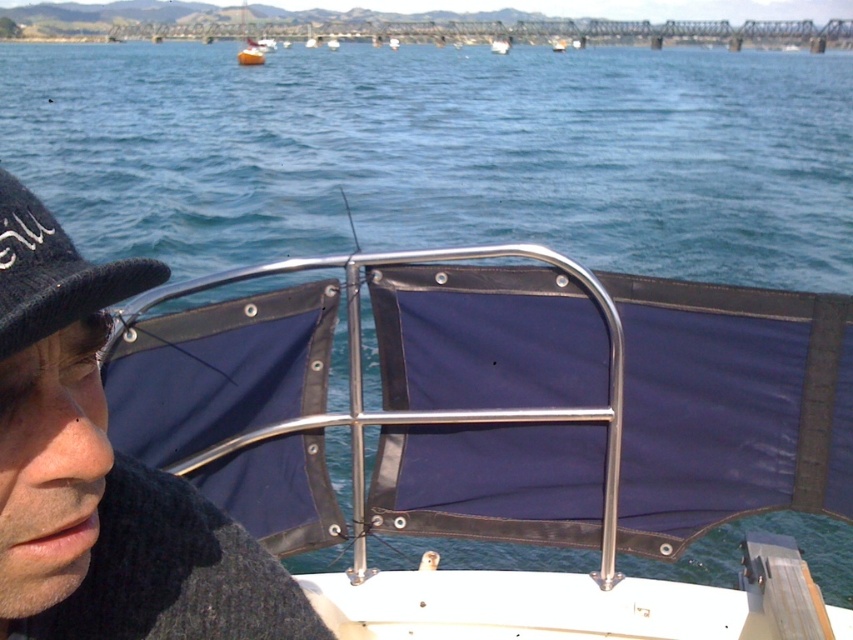
Based on the photo, can you confirm if black fabric baseball hat at left is taller than metallic silver boat at center?

Incorrect, black fabric baseball hat at left's height is not larger of metallic silver boat at center's.

Between black fabric baseball hat at left and metallic silver boat at center, which one appears on the left side from the viewer's perspective?

Positioned to the left is black fabric baseball hat at left.

You are a GUI agent. You are given a task and a screenshot of the screen. Output one action in this format:
    pyautogui.click(x=<x>, y=<y>)
    Task: Click on the black fabric baseball hat at left
    The height and width of the screenshot is (640, 853).
    Given the screenshot: What is the action you would take?
    (x=53, y=273)

Can you confirm if blue water at center is thinner than metallic silver boat at center?

Incorrect, blue water at center's width is not less than metallic silver boat at center's.

Consider the image. Is blue water at center closer to the viewer compared to metallic silver boat at center?

Yes, blue water at center is in front of metallic silver boat at center.

Between point (799, 170) and point (490, 49), which one is positioned behind?

Positioned behind is point (490, 49).

Where is `blue water at center`? blue water at center is located at coordinates (444, 154).

Who is positioned more to the right, black knit cap at left or metallic silver boat at center?

metallic silver boat at center is more to the right.

Does black knit cap at left have a larger size compared to metallic silver boat at center?

Incorrect, black knit cap at left is not larger than metallic silver boat at center.

Between point (28, 579) and point (491, 51), which one is positioned in front?

Point (28, 579)

Locate an element on the screen. The height and width of the screenshot is (640, 853). black knit cap at left is located at coordinates (103, 474).